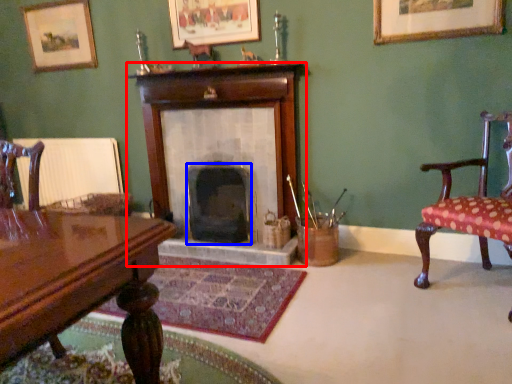
Question: Which object appears farthest to the camera in this image, fireplace (highlighted by a red box) or fireplace (highlighted by a blue box)?

Choices:
 (A) fireplace
 (B) fireplace

Answer: (B)